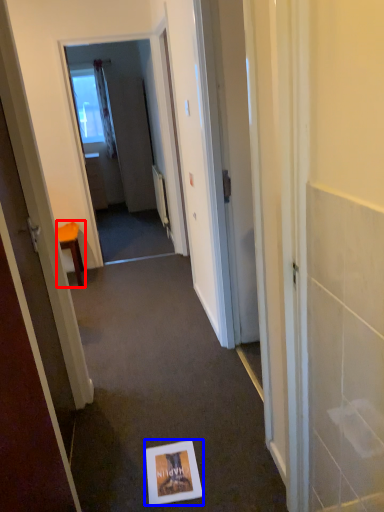
Question: Which object appears closest to the camera in this image, furniture (highlighted by a red box) or postcard (highlighted by a blue box)?

Choices:
 (A) furniture
 (B) postcard

Answer: (B)